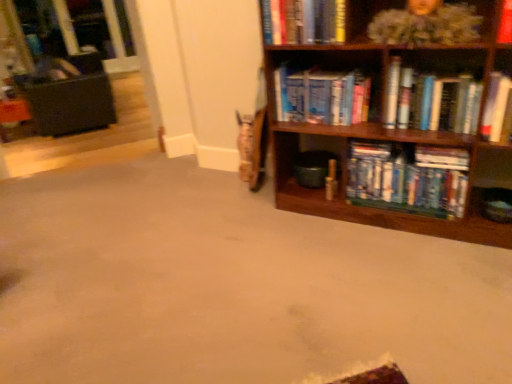
Find the location of a particular element. This screenshot has height=384, width=512. free space in front of wooden bookcase at right is located at coordinates (395, 286).